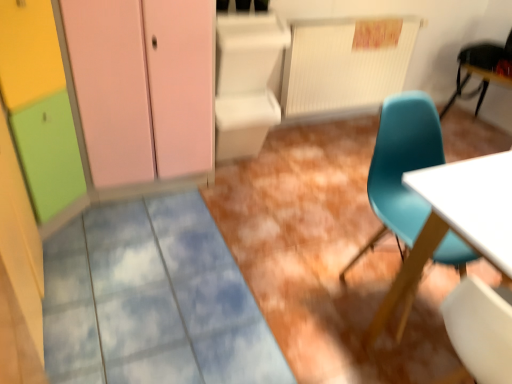
Question: Is teal plastic chair at upper right, the 1th chair viewed from the top, facing away from matte pink cabinet at upper left?

Choices:
 (A) yes
 (B) no

Answer: (B)

Question: Can you confirm if teal plastic chair at upper right, which appears as the 2th chair when viewed from the left, is taller than matte pink cabinet at upper left?

Choices:
 (A) yes
 (B) no

Answer: (B)

Question: Is teal plastic chair at upper right, the 1th chair viewed from the top, outside of matte pink cabinet at upper left?

Choices:
 (A) yes
 (B) no

Answer: (A)

Question: Could you tell me if teal plastic chair at upper right, arranged as the 2th chair when ordered from the bottom, is turned towards matte pink cabinet at upper left?

Choices:
 (A) no
 (B) yes

Answer: (B)

Question: Is teal plastic chair at upper right, arranged as the 2th chair when ordered from the bottom, not near matte pink cabinet at upper left?

Choices:
 (A) no
 (B) yes

Answer: (B)

Question: Is the position of teal plastic chair at upper right, the 1th chair viewed from the top, more distant than that of matte pink cabinet at upper left?

Choices:
 (A) no
 (B) yes

Answer: (B)

Question: Is matte plastic chair at right, marked as the second chair in a right-to-left arrangement, not close to matte pink cabinet at upper left?

Choices:
 (A) no
 (B) yes

Answer: (B)

Question: From the image's perspective, is matte plastic chair at right, the 2th chair in the top-to-bottom sequence, above matte pink cabinet at upper left?

Choices:
 (A) yes
 (B) no

Answer: (B)

Question: Is matte plastic chair at right, the 2th chair in the top-to-bottom sequence, not within matte pink cabinet at upper left?

Choices:
 (A) yes
 (B) no

Answer: (A)

Question: Is matte pink cabinet at upper left completely or partially inside matte plastic chair at right, marked as the second chair in a right-to-left arrangement?

Choices:
 (A) yes
 (B) no

Answer: (B)

Question: Can you confirm if matte plastic chair at right, the first chair viewed from the left, is wider than matte pink cabinet at upper left?

Choices:
 (A) no
 (B) yes

Answer: (A)

Question: Is matte plastic chair at right, the first chair from the front, to the right of matte pink cabinet at upper left from the viewer's perspective?

Choices:
 (A) no
 (B) yes

Answer: (B)

Question: From a real-world perspective, is teal plastic chair at upper right, which appears as the 2th chair when viewed from the left, on top of matte plastic chair at right, which is the second chair from back to front?

Choices:
 (A) no
 (B) yes

Answer: (B)